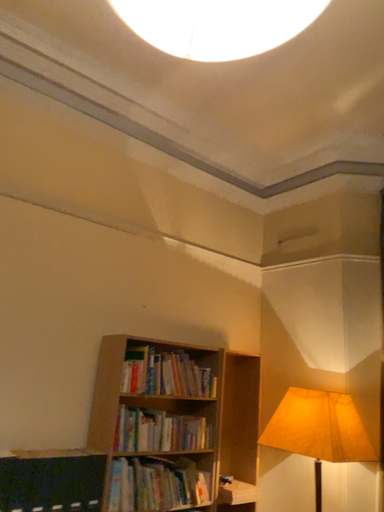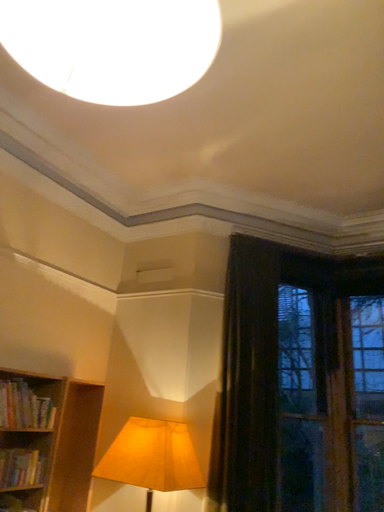
Question: Which way did the camera rotate in the video?

Choices:
 (A) rotated right
 (B) rotated left

Answer: (A)